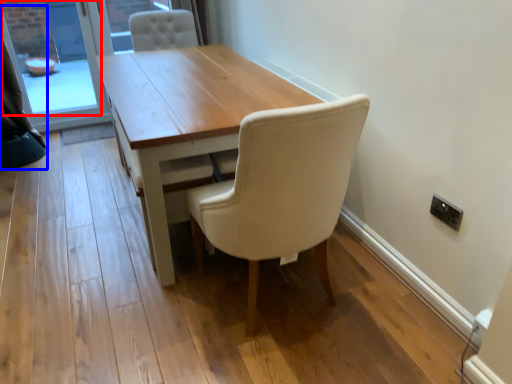
Question: Among these objects, which one is farthest to the camera, window screen (highlighted by a red box) or curtain (highlighted by a blue box)?

Choices:
 (A) window screen
 (B) curtain

Answer: (A)